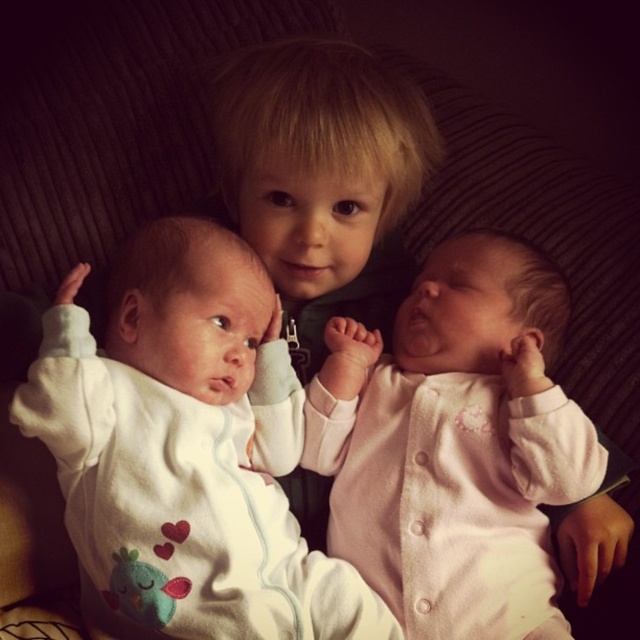
Who is positioned more to the left, pink matte onesie at center or blonde hair at center?

blonde hair at center

Which of these two, pink matte onesie at center or blonde hair at center, stands shorter?

blonde hair at center is shorter.

Measure the distance between pink matte onesie at center and camera.

31.66 inches

The image size is (640, 640). What are the coordinates of `pink matte onesie at center` in the screenshot? It's located at (454, 444).

Does white soft onesie at center have a lesser height compared to pink matte onesie at center?

Incorrect, white soft onesie at center's height does not fall short of pink matte onesie at center's.

Who is more distant from viewer, (81, 362) or (545, 492)?

Positioned behind is point (545, 492).

Is point (211, 250) closer to viewer compared to point (536, 275)?

Yes, point (211, 250) is closer to viewer.

The height and width of the screenshot is (640, 640). Find the location of `white soft onesie at center`. white soft onesie at center is located at coordinates coord(188,448).

Between white soft onesie at center and blonde hair at center, which one appears on the left side from the viewer's perspective?

white soft onesie at center is more to the left.

Can you confirm if white soft onesie at center is taller than blonde hair at center?

Correct, white soft onesie at center is much taller as blonde hair at center.

Who is more distant from viewer, (115,506) or (276,120)?

Positioned behind is point (276,120).

Find the location of `white soft onesie at center`. white soft onesie at center is located at coordinates (188, 448).